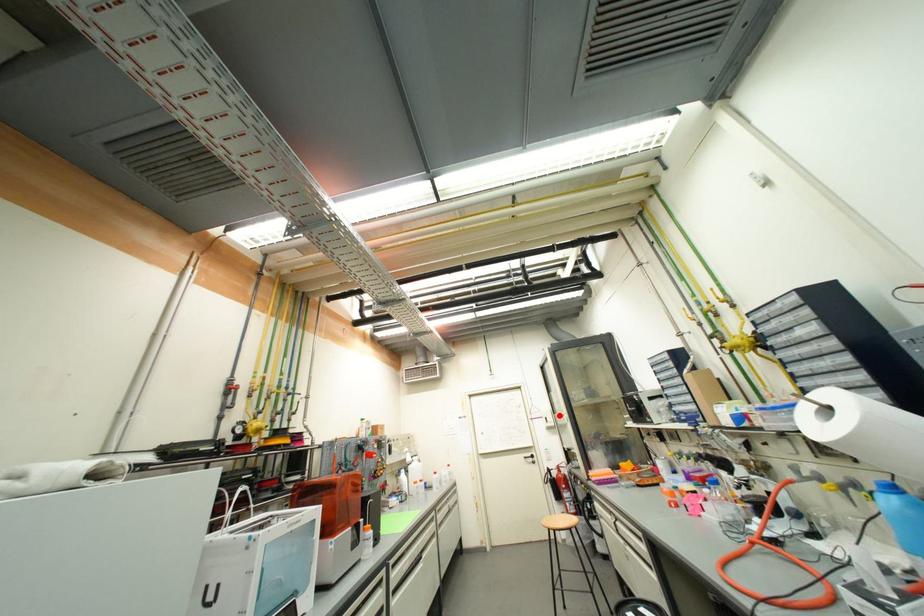
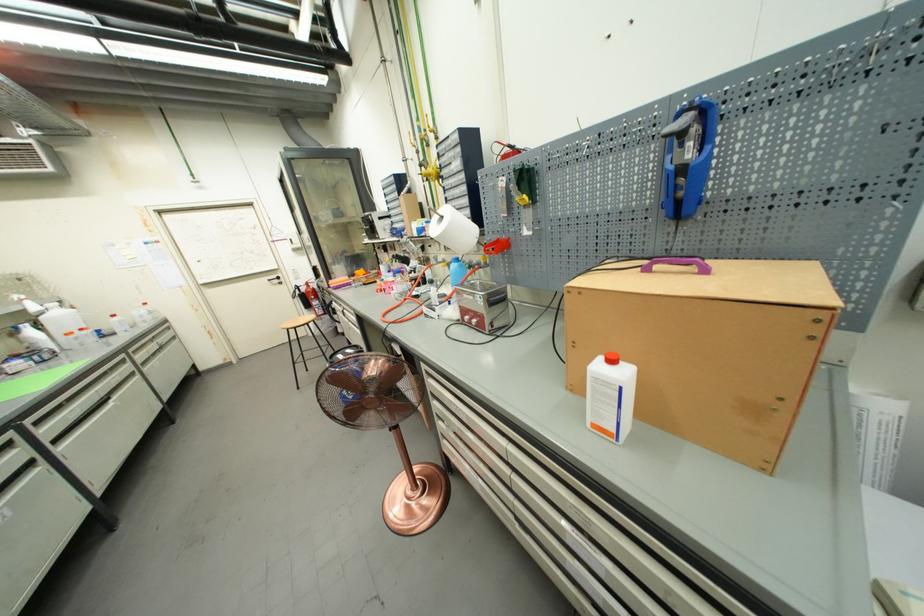
Question: I am providing you with two images of the same scene from different viewpoints. A red point is shown in image1. For the corresponding object point in image2, is it positioned nearer or farther from the camera?

Choices:
 (A) Nearer
 (B) Farther

Answer: (A)